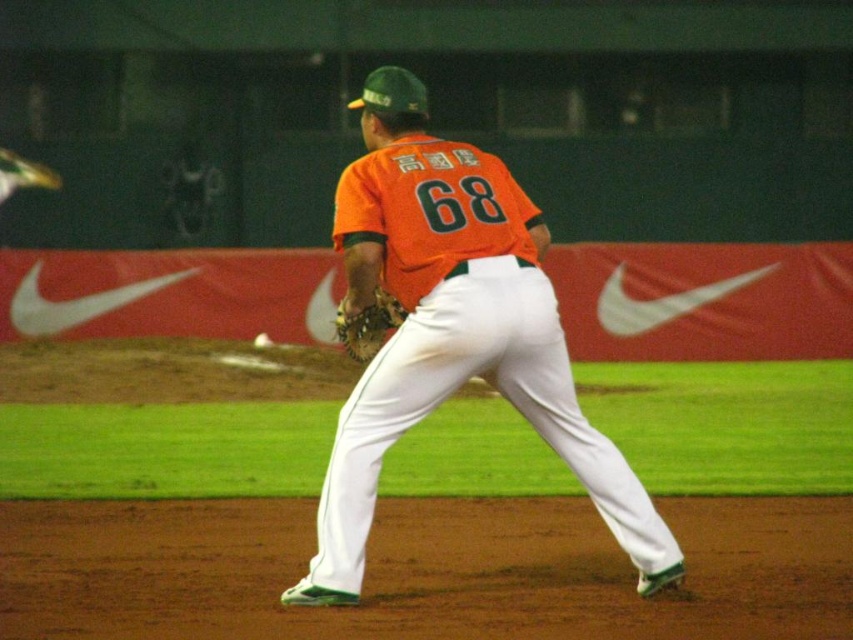
Which is more to the right, orange matte jersey at center or leather textured glove at center?

orange matte jersey at center

The image size is (853, 640). Describe the element at coordinates (453, 332) in the screenshot. I see `orange matte jersey at center` at that location.

Between point (544, 352) and point (364, 342), which one is positioned behind?

Point (364, 342)

You are a GUI agent. You are given a task and a screenshot of the screen. Output one action in this format:
    pyautogui.click(x=<x>, y=<y>)
    Task: Click on the orange matte jersey at center
    
    Given the screenshot: What is the action you would take?
    pyautogui.click(x=453, y=332)